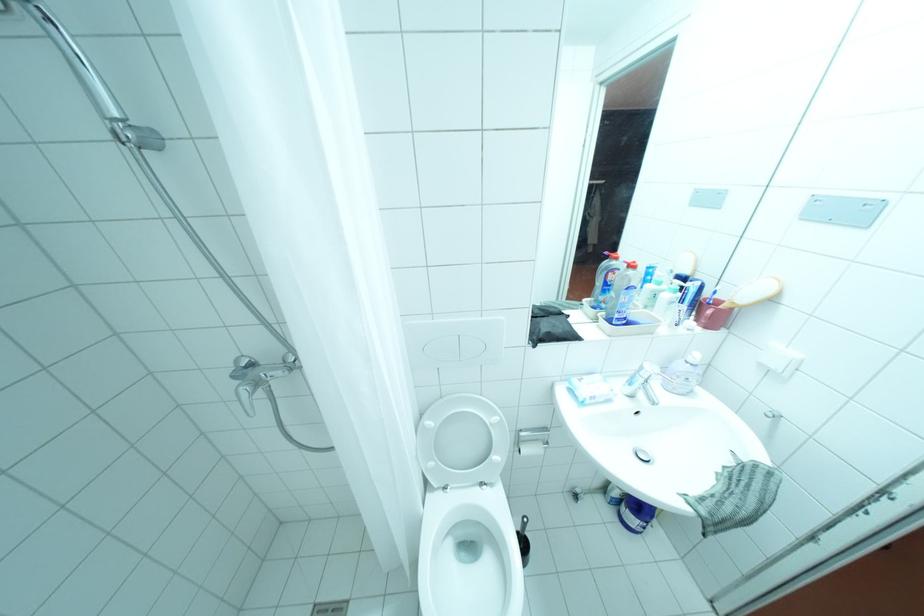
Image resolution: width=924 pixels, height=616 pixels. Find the location of `toilet flush button`. toilet flush button is located at coordinates (466, 513).